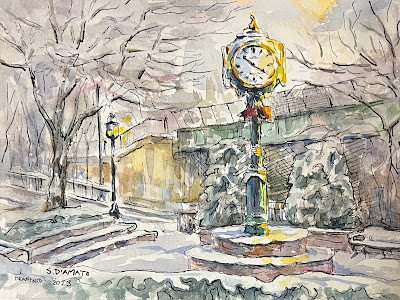
This screenshot has height=300, width=400. I want to click on clock, so click(257, 63).